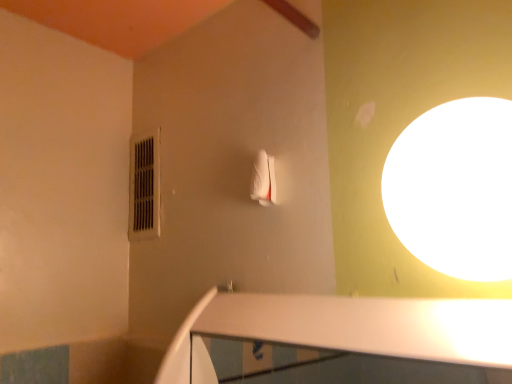
This screenshot has width=512, height=384. Describe the element at coordinates (144, 187) in the screenshot. I see `black plastic air conditioner at upper left` at that location.

Locate an element on the screen. Image resolution: width=512 pixels, height=384 pixels. black plastic air conditioner at upper left is located at coordinates (144, 187).

The image size is (512, 384). Find the location of `white glossy light at upper right`. white glossy light at upper right is located at coordinates (454, 188).

This screenshot has width=512, height=384. What do you see at coordinates (454, 188) in the screenshot?
I see `white glossy light at upper right` at bounding box center [454, 188].

The width and height of the screenshot is (512, 384). Find the location of `black plastic air conditioner at upper left`. black plastic air conditioner at upper left is located at coordinates (144, 187).

Which object is positioned more to the left, black plastic air conditioner at upper left or white glossy light at upper right?

Result: From the viewer's perspective, black plastic air conditioner at upper left appears more on the left side.

Is the depth of black plastic air conditioner at upper left greater than that of white glossy light at upper right?

Yes, the depth of black plastic air conditioner at upper left is greater than that of white glossy light at upper right.

Does point (135, 166) appear closer or farther from the camera than point (509, 172)?

Point (135, 166) is farther from the camera than point (509, 172).

From the image's perspective, between black plastic air conditioner at upper left and white glossy light at upper right, who is located below?

white glossy light at upper right, from the image's perspective.

From a real-world perspective, is black plastic air conditioner at upper left over white glossy light at upper right?

Indeed, from a real-world perspective, black plastic air conditioner at upper left stands above white glossy light at upper right.

Is black plastic air conditioner at upper left thinner than white glossy light at upper right?

Indeed, black plastic air conditioner at upper left has a lesser width compared to white glossy light at upper right.

Considering the relative sizes of black plastic air conditioner at upper left and white glossy light at upper right in the image provided, is black plastic air conditioner at upper left taller than white glossy light at upper right?

Yes.

In terms of size, does black plastic air conditioner at upper left appear bigger or smaller than white glossy light at upper right?

Clearly, black plastic air conditioner at upper left is smaller in size than white glossy light at upper right.

Choose the correct answer: Is black plastic air conditioner at upper left inside white glossy light at upper right or outside it?

The correct answer is: outside.

Is black plastic air conditioner at upper left next to white glossy light at upper right and touching it?

There is a gap between black plastic air conditioner at upper left and white glossy light at upper right.

Is black plastic air conditioner at upper left facing towards white glossy light at upper right?

No, black plastic air conditioner at upper left is not facing towards white glossy light at upper right.

This screenshot has height=384, width=512. I want to click on light lying on the right of black plastic air conditioner at upper left, so click(x=454, y=188).

Considering the relative positions of white glossy light at upper right and black plastic air conditioner at upper left in the image provided, is white glossy light at upper right to the right of black plastic air conditioner at upper left from the viewer's perspective?

Indeed, white glossy light at upper right is positioned on the right side of black plastic air conditioner at upper left.

Which object is further away from the camera, white glossy light at upper right or black plastic air conditioner at upper left?

black plastic air conditioner at upper left.

Does point (424, 184) come farther from viewer compared to point (144, 188)?

No, (424, 184) is in front of (144, 188).

From the image's perspective, does white glossy light at upper right appear higher than black plastic air conditioner at upper left?

No, from the image's perspective, white glossy light at upper right is not over black plastic air conditioner at upper left.

From a real-world perspective, is white glossy light at upper right positioned above or below black plastic air conditioner at upper left?

From a real-world perspective, white glossy light at upper right is physically below black plastic air conditioner at upper left.

Does white glossy light at upper right have a lesser width compared to black plastic air conditioner at upper left?

In fact, white glossy light at upper right might be wider than black plastic air conditioner at upper left.

Between white glossy light at upper right and black plastic air conditioner at upper left, which one has less height?

white glossy light at upper right.

Which of these two, white glossy light at upper right or black plastic air conditioner at upper left, is bigger?

Bigger between the two is white glossy light at upper right.

Do you think white glossy light at upper right is within black plastic air conditioner at upper left, or outside of it?

white glossy light at upper right exists outside the volume of black plastic air conditioner at upper left.

Is white glossy light at upper right next to black plastic air conditioner at upper left and touching it?

They are not placed beside each other.

Is white glossy light at upper right turned away from black plastic air conditioner at upper left?

No, white glossy light at upper right's orientation is not away from black plastic air conditioner at upper left.

How different are the orientations of white glossy light at upper right and black plastic air conditioner at upper left in degrees?

There is a 0.448-degree angle between the facing directions of white glossy light at upper right and black plastic air conditioner at upper left.

This screenshot has width=512, height=384. What are the coordinates of `air conditioner above the white glossy light at upper right (from the image's perspective)` in the screenshot? It's located at (144, 187).

You are a GUI agent. You are given a task and a screenshot of the screen. Output one action in this format:
    pyautogui.click(x=<x>, y=<y>)
    Task: Click on the air conditioner that is above the white glossy light at upper right (from a real-world perspective)
    The image size is (512, 384).
    Given the screenshot: What is the action you would take?
    pyautogui.click(x=144, y=187)

This screenshot has height=384, width=512. Find the location of `air conditioner on the left of white glossy light at upper right`. air conditioner on the left of white glossy light at upper right is located at coordinates (144, 187).